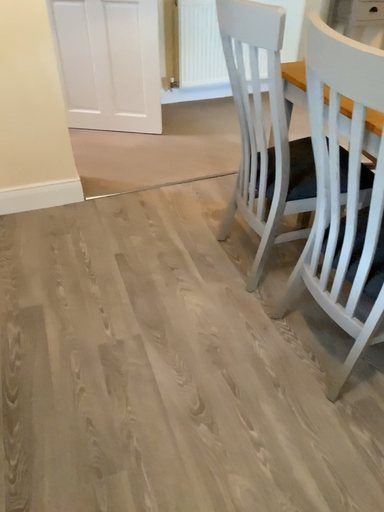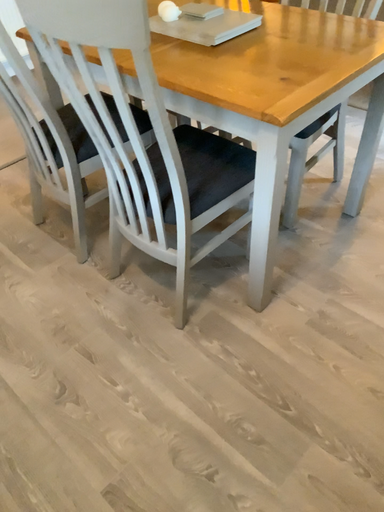
Question: How did the camera likely rotate when shooting the video?

Choices:
 (A) rotated right
 (B) rotated left

Answer: (A)